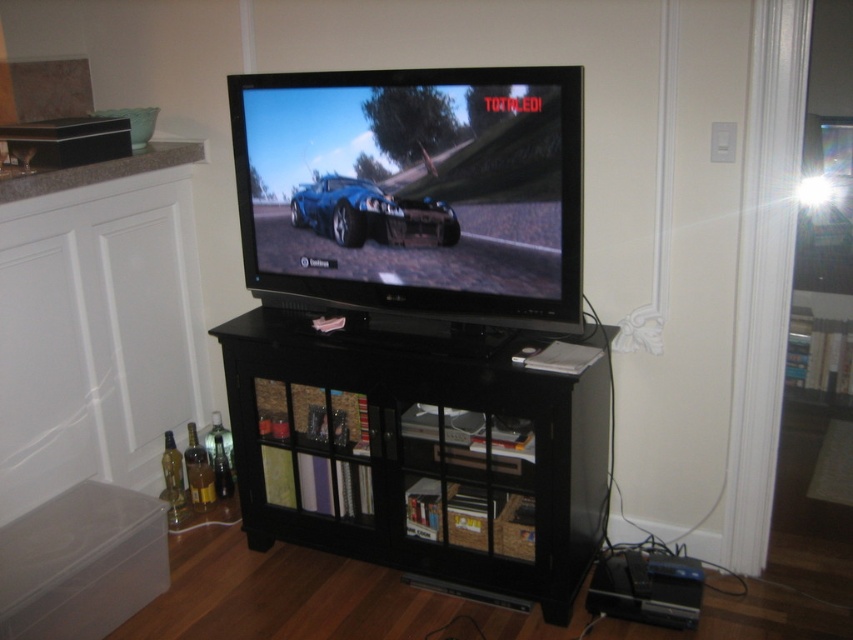
Question: Which point is farther from the camera taking this photo?

Choices:
 (A) (242, 378)
 (B) (526, 140)
 (C) (398, 243)

Answer: (A)

Question: Is black glossy flat screen tv at center wider than glossy blue car at center?

Choices:
 (A) yes
 (B) no

Answer: (A)

Question: Can you confirm if black glossy flat screen tv at center is positioned below glossy blue car at center?

Choices:
 (A) no
 (B) yes

Answer: (A)

Question: Can you confirm if black glossy entertainment center at center is bigger than black glossy flat screen tv at center?

Choices:
 (A) no
 (B) yes

Answer: (B)

Question: Which point is farther to the camera?

Choices:
 (A) (384, 225)
 (B) (445, 80)
 (C) (461, 582)

Answer: (C)

Question: Which point is farther to the camera?

Choices:
 (A) (314, 536)
 (B) (491, 188)
 (C) (360, 186)

Answer: (A)